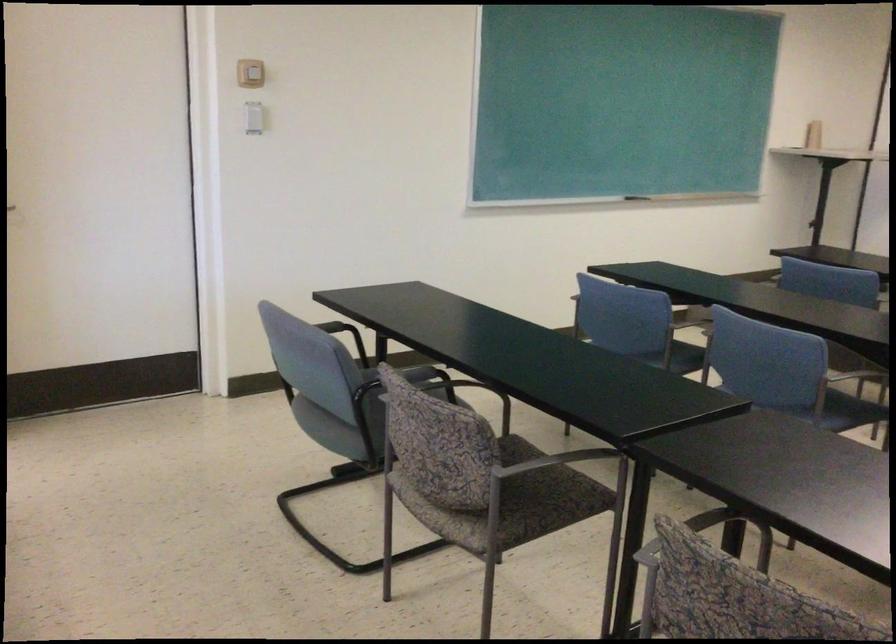
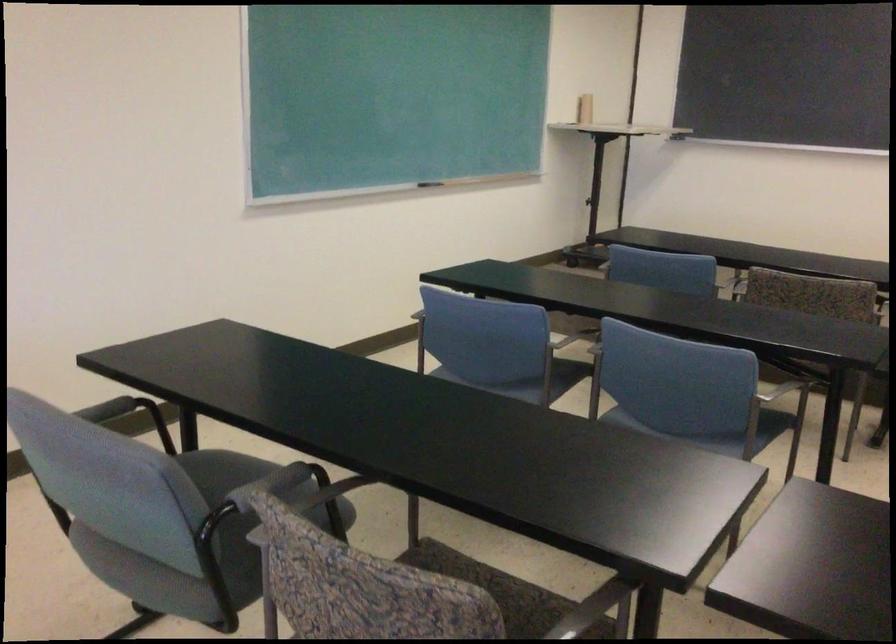
Question: What movement of the cameraman would produce the second image?

Choices:
 (A) Left
 (B) Right
 (C) Forward
 (D) Backward

Answer: (D)